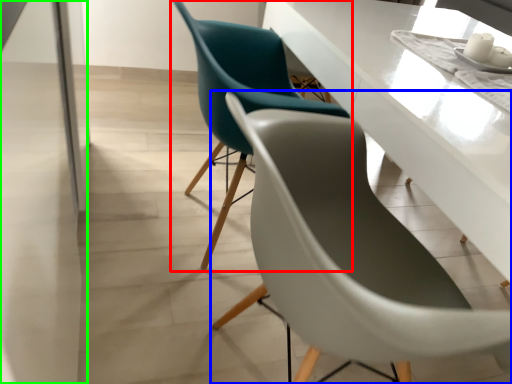
Question: Which is farther away from chair (highlighted by a red box)? chair (highlighted by a blue box) or glass door (highlighted by a green box)?

Choices:
 (A) chair
 (B) glass door

Answer: (B)